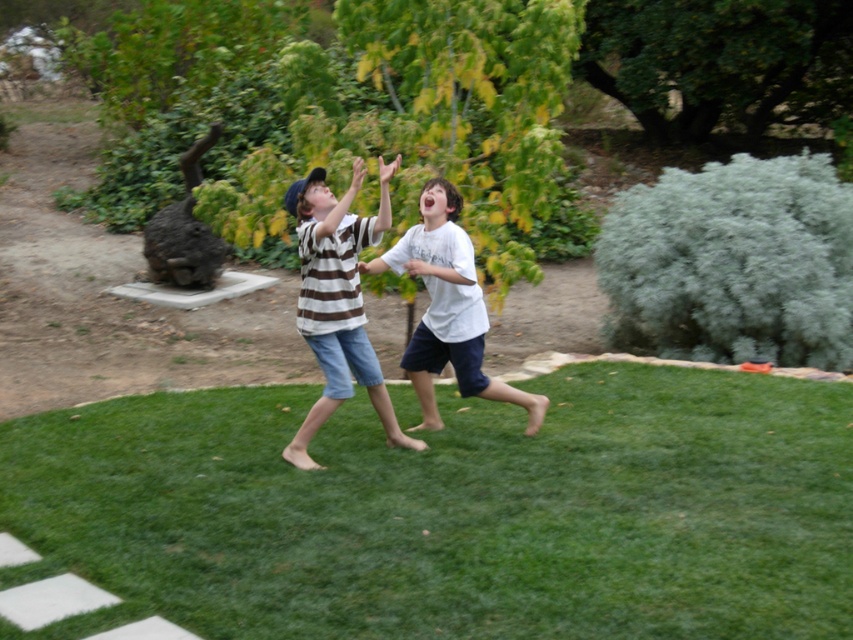
Which is more to the left, green leafy tree at upper center or white cotton shirt at center?

From the viewer's perspective, white cotton shirt at center appears more on the left side.

Measure the distance between point (770, 44) and camera.

Point (770, 44) and camera are 18.88 meters apart from each other.

Who is more distant from viewer, (x=851, y=35) or (x=459, y=257)?

Positioned behind is point (x=851, y=35).

Image resolution: width=853 pixels, height=640 pixels. I want to click on green leafy tree at upper center, so click(720, 61).

Can you confirm if green grass at center is positioned above brown striped shirt at center?

No.

Which is in front, point (344, 556) or point (364, 232)?

Point (344, 556) is more forward.

Is point (65, 481) in front of point (314, 266)?

Yes.

Where is `green grass at center`? green grass at center is located at coordinates (451, 512).

Is gray fluffy bush at right shorter than green leafy tree at upper center?

No, gray fluffy bush at right is not shorter than green leafy tree at upper center.

The height and width of the screenshot is (640, 853). Identify the location of gray fluffy bush at right. (733, 262).

I want to click on gray fluffy bush at right, so click(733, 262).